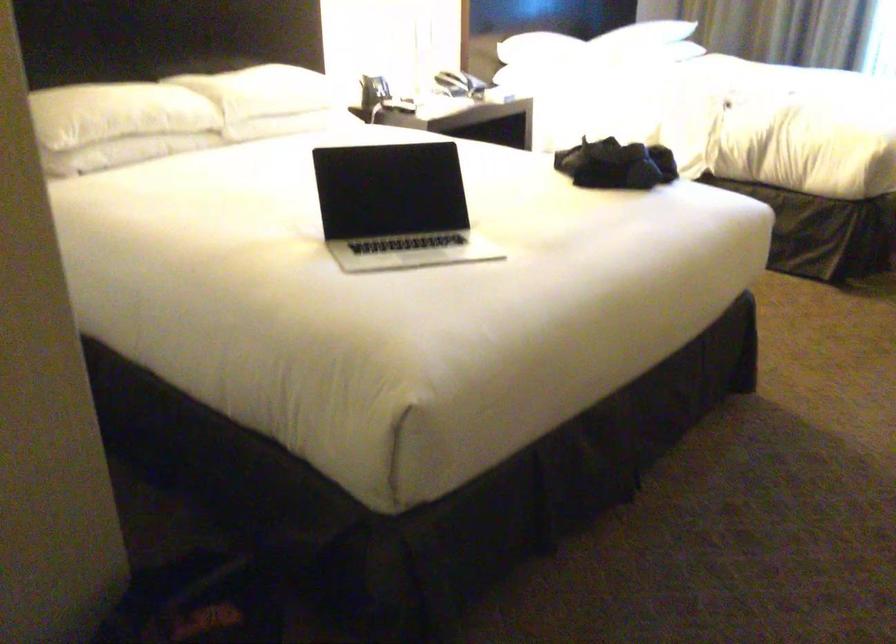
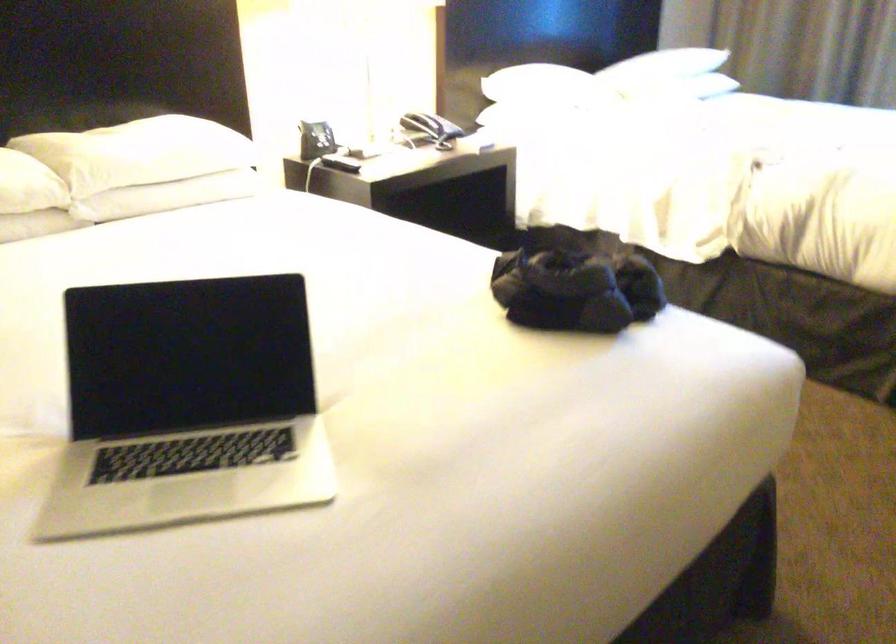
Locate, in the second image, the point that corresponds to point 392,221 in the first image.

(186, 406)